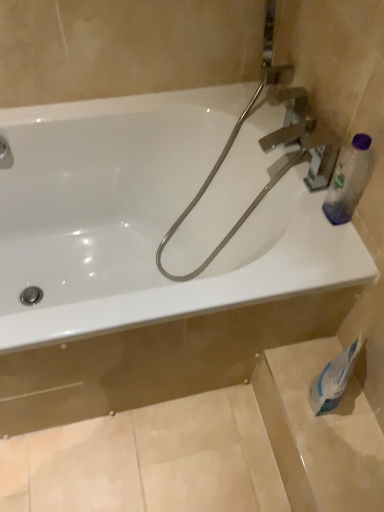
This screenshot has width=384, height=512. I want to click on vacant space situated on the left part of transparent plastic bottle at upper right, so click(297, 215).